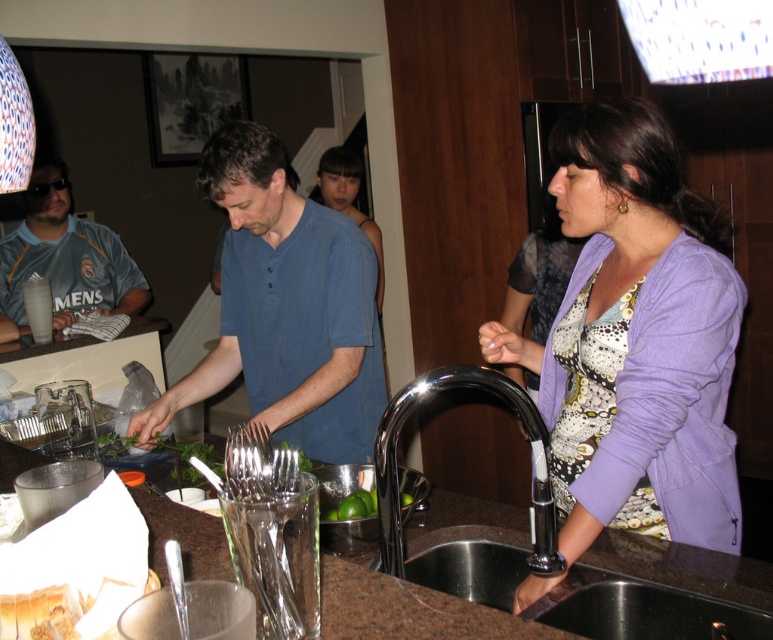
Question: Estimate the real-world distances between objects in this image. Which object is closer to the green matte limes at center?

Choices:
 (A) chrome metallic faucet at sink right
 (B) brown granite countertop at center

Answer: (B)

Question: Can you confirm if purple cotton sweater at lower right is positioned below metallic sink at lower center?

Choices:
 (A) no
 (B) yes

Answer: (A)

Question: Which point is farther to the camera?

Choices:
 (A) purple cotton sweater at lower right
 (B) green matte limes at center
 (C) chrome metallic faucet at sink right
 (D) blue cotton shirt at center

Answer: (D)

Question: Does purple cotton sweater at lower right have a larger size compared to blue cotton shirt at center?

Choices:
 (A) yes
 (B) no

Answer: (A)

Question: Can you confirm if purple cotton sweater at lower right is bigger than chrome metallic faucet at sink right?

Choices:
 (A) no
 (B) yes

Answer: (B)

Question: Estimate the real-world distances between objects in this image. Which object is farther from the green matte limes at center?

Choices:
 (A) matte blue shirt at center
 (B) brown granite countertop at center

Answer: (A)